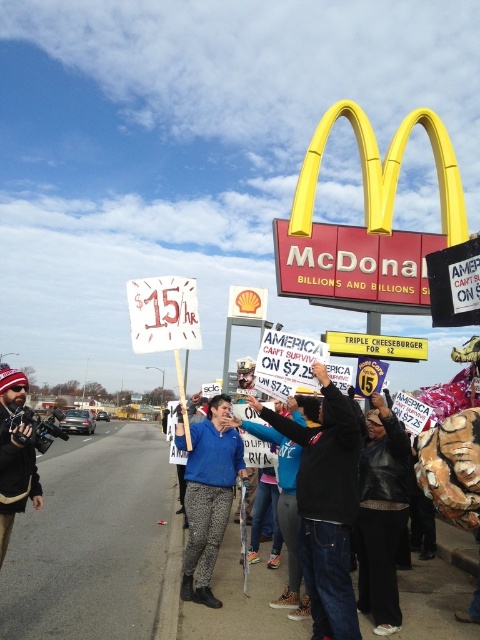
You are a photographer trying to capture a clear shot of the protest signs. You notice a black leather jacket at center and a knitted wool hat at left in your frame. Which object should you adjust your camera to focus on first to ensure both are in the frame?

The knitted wool hat at left should be focused on first since the black leather jacket at center is positioned to its right. By centering the knitted wool hat at left first, you can then adjust the frame to include the black leather jacket at center on its right side.

You are a photographer standing at the edge of the protest scene outside a McDonalds restaurant. You want to take a photo that includes both the McDonalds sign and the black leather jacket at center. Given that your camera has a maximum zoom range of 15 meters, will you be able to capture both subjects in the same frame?

The black leather jacket at center and the McDonalds sign are 16.09 meters apart. Since the camera can only zoom up to 15 meters, you won